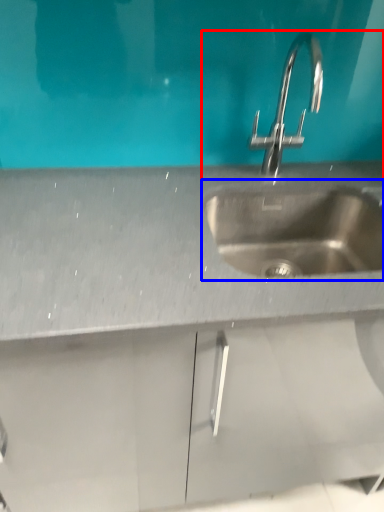
Question: Which object appears closest to the camera in this image, sink (highlighted by a red box) or sink (highlighted by a blue box)?

Choices:
 (A) sink
 (B) sink

Answer: (A)